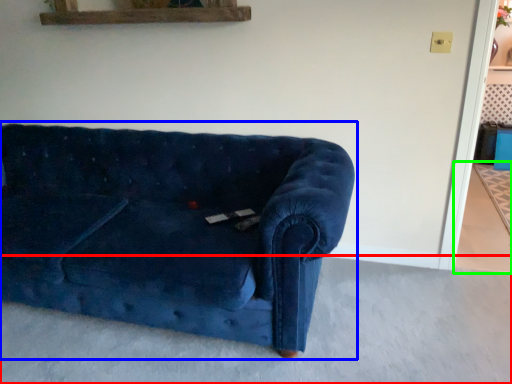
Question: Which object is the closest to the concrete (highlighted by a red box)? Choose among these: studio couch (highlighted by a blue box) or concrete (highlighted by a green box).

Choices:
 (A) studio couch
 (B) concrete

Answer: (A)